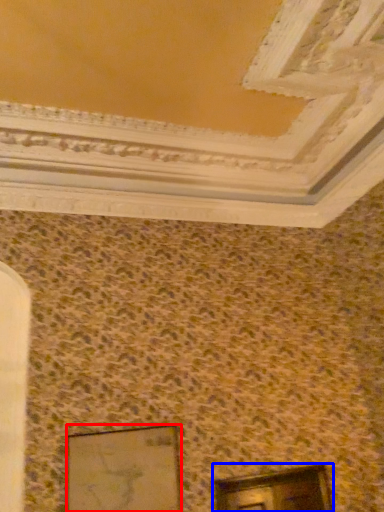
Question: Which object is further to the camera taking this photo, picture frame (highlighted by a red box) or window (highlighted by a blue box)?

Choices:
 (A) picture frame
 (B) window

Answer: (B)